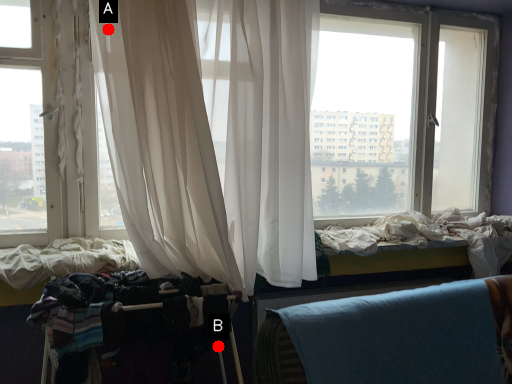
Question: Two points are circled on the image, labeled by A and B beside each circle. Among these points, which one is nearest to the camera?

Choices:
 (A) A is closer
 (B) B is closer

Answer: (A)